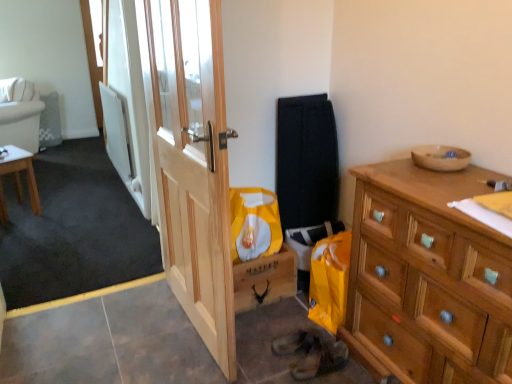
Locate an element on the screen. The image size is (512, 384). vacant space underneath natural wood door at center (from a real-world perspective) is located at coordinates (190, 328).